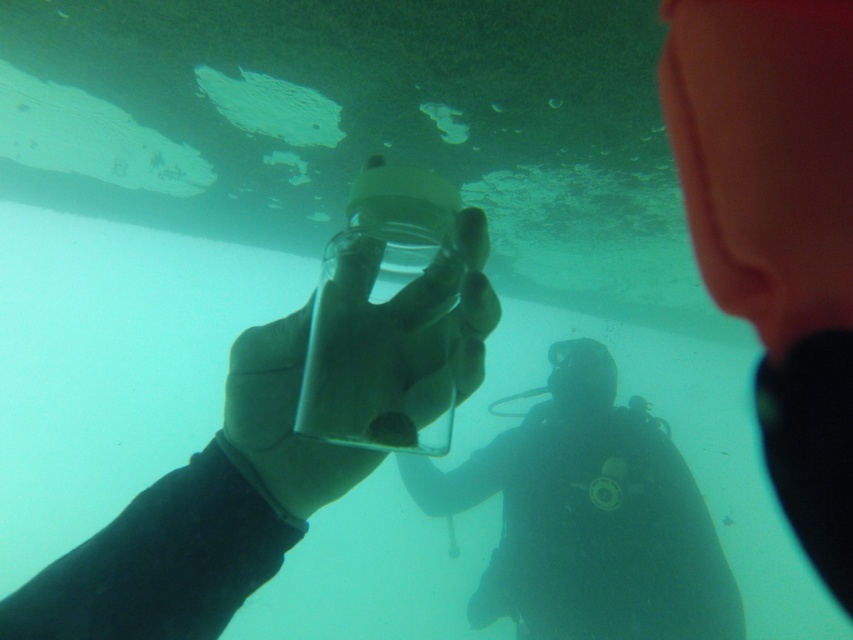
Is black scuba suit at center wider than transparent glass jar at center?

Correct, the width of black scuba suit at center exceeds that of transparent glass jar at center.

Who is higher up, black scuba suit at center or transparent glass jar at center?

transparent glass jar at center is higher up.

Describe the element at coordinates (589, 516) in the screenshot. The width and height of the screenshot is (853, 640). I see `black scuba suit at center` at that location.

Find the location of a particular element. black scuba suit at center is located at coordinates (589, 516).